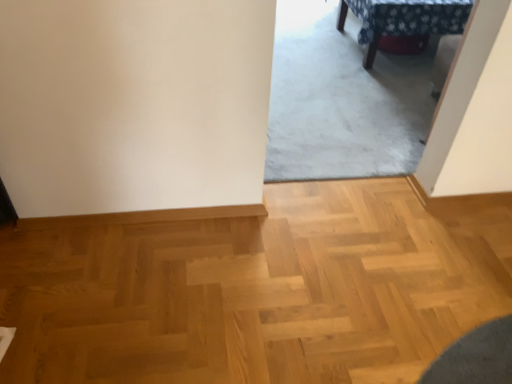
Image resolution: width=512 pixels, height=384 pixels. I want to click on vacant space that is to the left of patterned fabric table at upper right, so point(305,48).